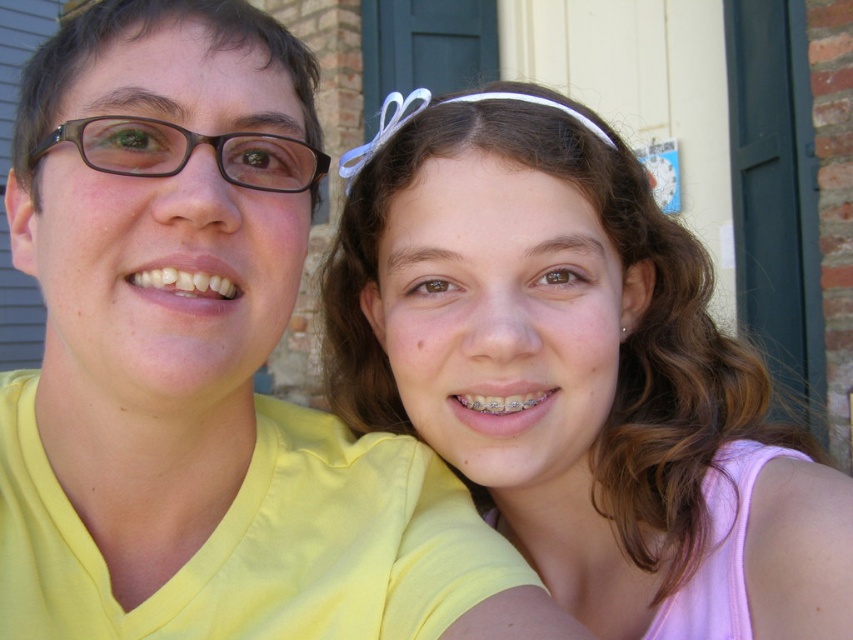
Which is behind, point (701, 464) or point (111, 115)?

Positioned behind is point (701, 464).

What do you see at coordinates (576, 372) in the screenshot? Image resolution: width=853 pixels, height=640 pixels. I see `pink fabric headband at upper center` at bounding box center [576, 372].

Where is `pink fabric headband at upper center`? The height and width of the screenshot is (640, 853). pink fabric headband at upper center is located at coordinates (576, 372).

Which is more to the right, yellow matte shirt at upper left or brown matte glasses at left?

yellow matte shirt at upper left

Is point (25, 244) farther from viewer compared to point (231, 172)?

That is True.

Where is `yellow matte shirt at upper left`? The width and height of the screenshot is (853, 640). yellow matte shirt at upper left is located at coordinates (158, 273).

Is pink fabric headband at upper center thinner than yellow matte shirt at upper left?

No.

In the scene shown: Can you confirm if pink fabric headband at upper center is positioned above yellow matte shirt at upper left?

Actually, pink fabric headband at upper center is below yellow matte shirt at upper left.

At what (x,y) coordinates should I click in order to perform the action: click on pink fabric headband at upper center. Please return your answer as a coordinate pair (x, y). Looking at the image, I should click on (576, 372).